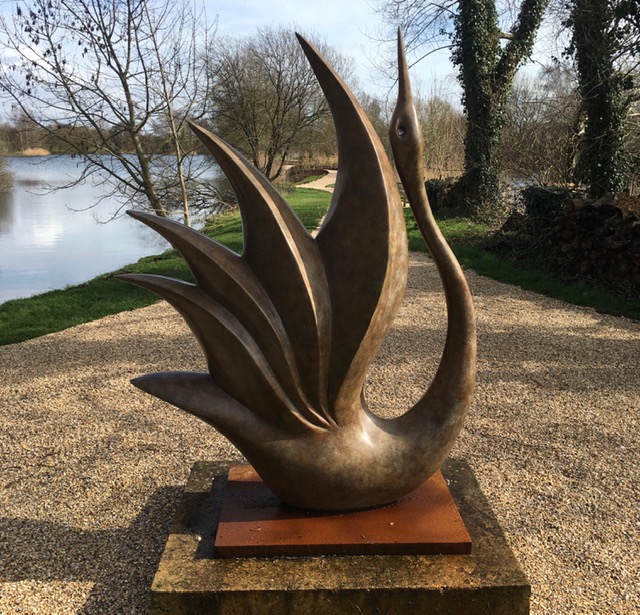
Locate an element on the screen. This screenshot has width=640, height=615. sculpture is located at coordinates (340, 450).